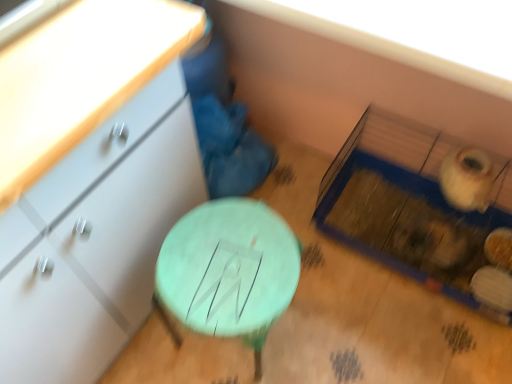
Where is `empty space that is to the right of green painted wood stool at center`? The image size is (512, 384). empty space that is to the right of green painted wood stool at center is located at coordinates (334, 320).